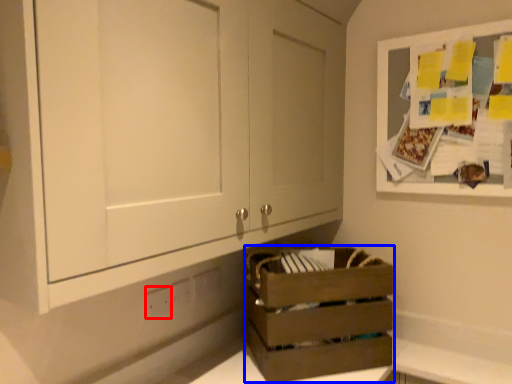
Question: Among these objects, which one is nearest to the camera, electric outlet (highlighted by a red box) or crate (highlighted by a blue box)?

Choices:
 (A) electric outlet
 (B) crate

Answer: (B)